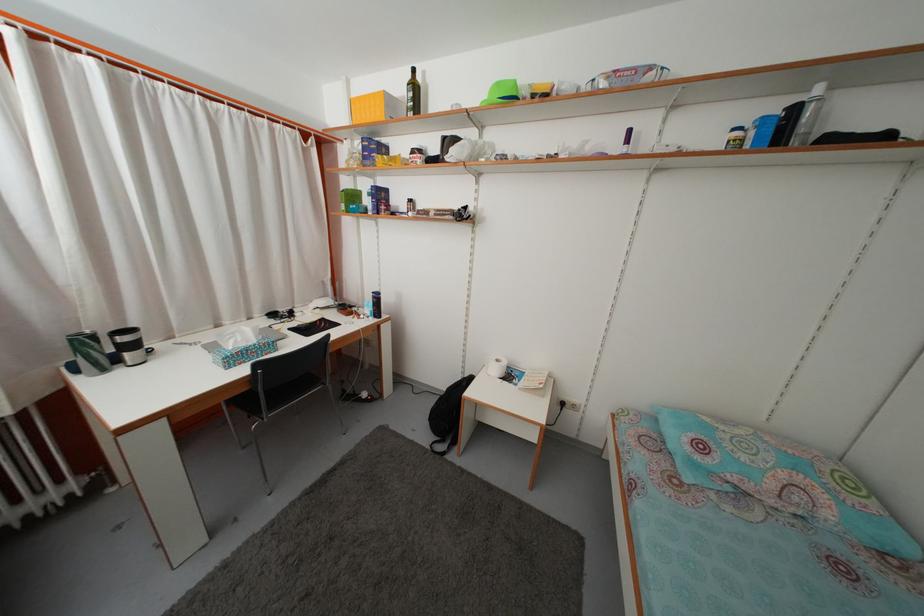
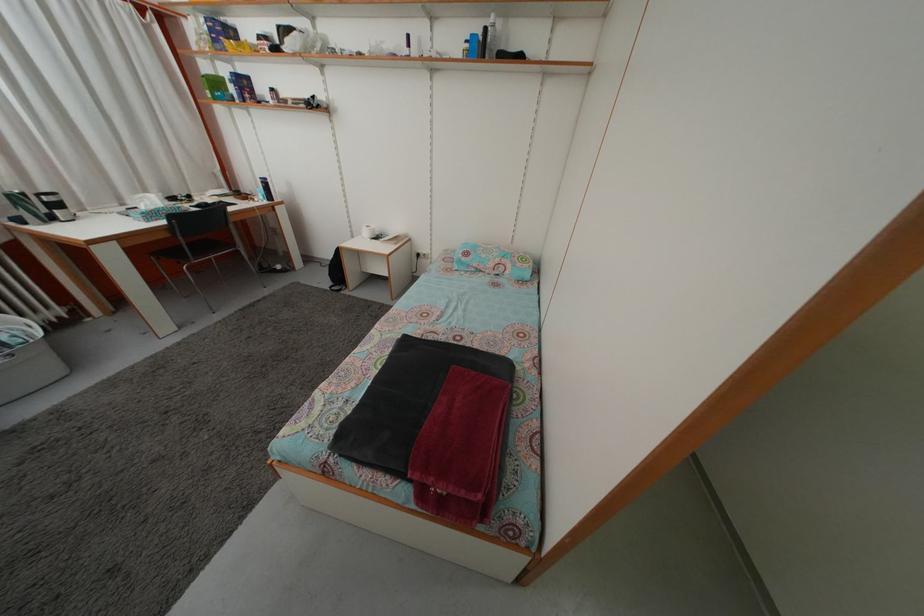
The point at [359,204] is marked in the first image. Where is the corresponding point in the second image?

(223, 91)